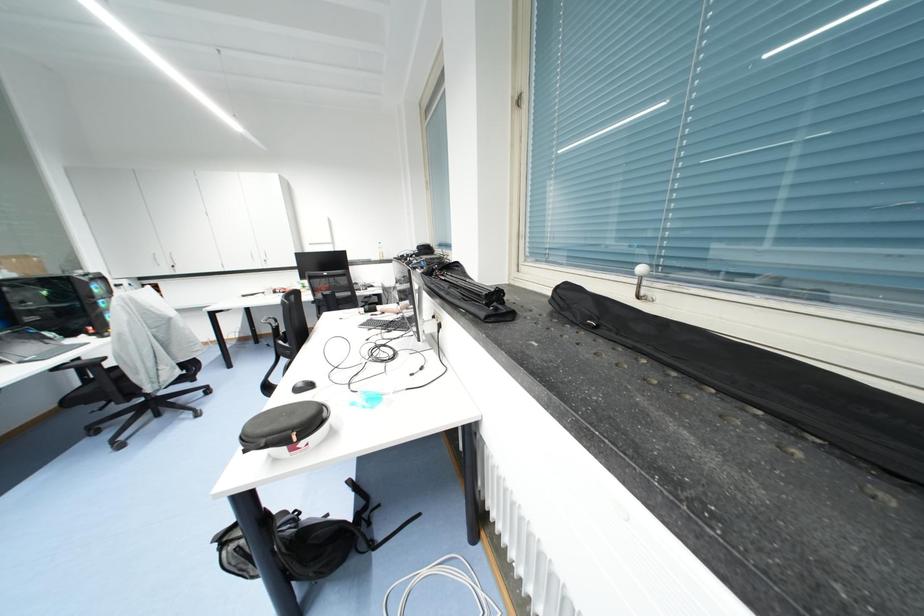
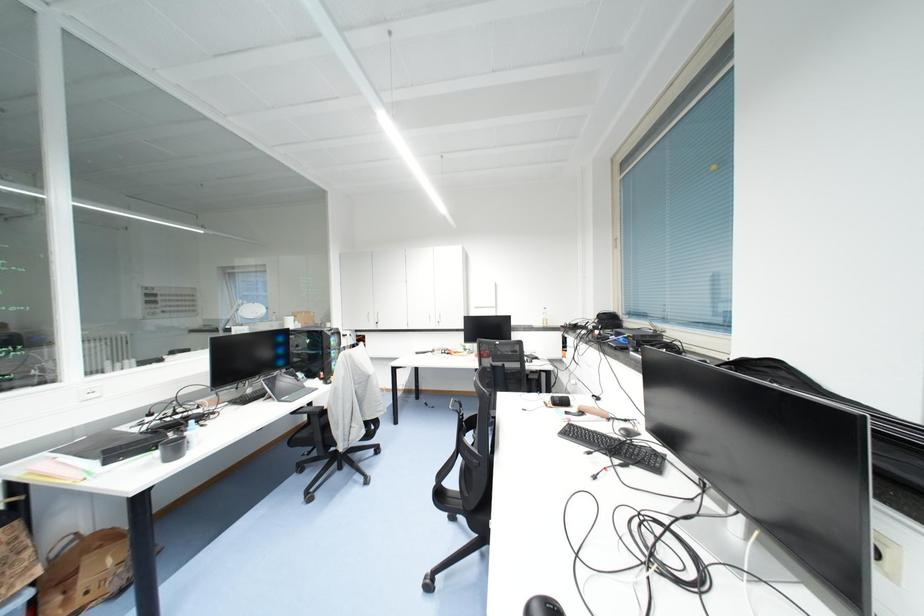
Question: The camera is either moving clockwise (left) or counter-clockwise (right) around the object. The first image is from the beginning of the video and the second image is from the end. Is the camera moving left or right when shooting the video?

Choices:
 (A) Left
 (B) Right

Answer: (B)